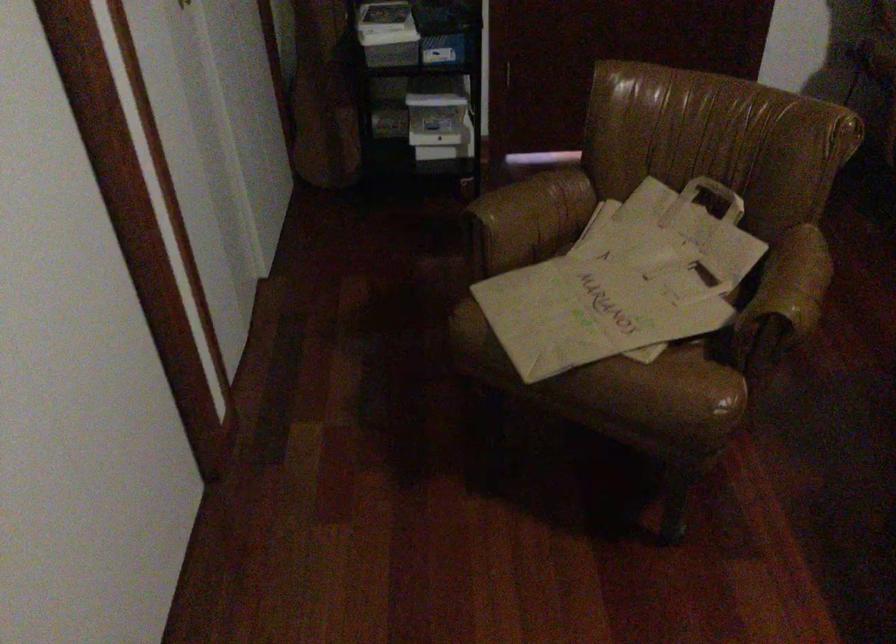
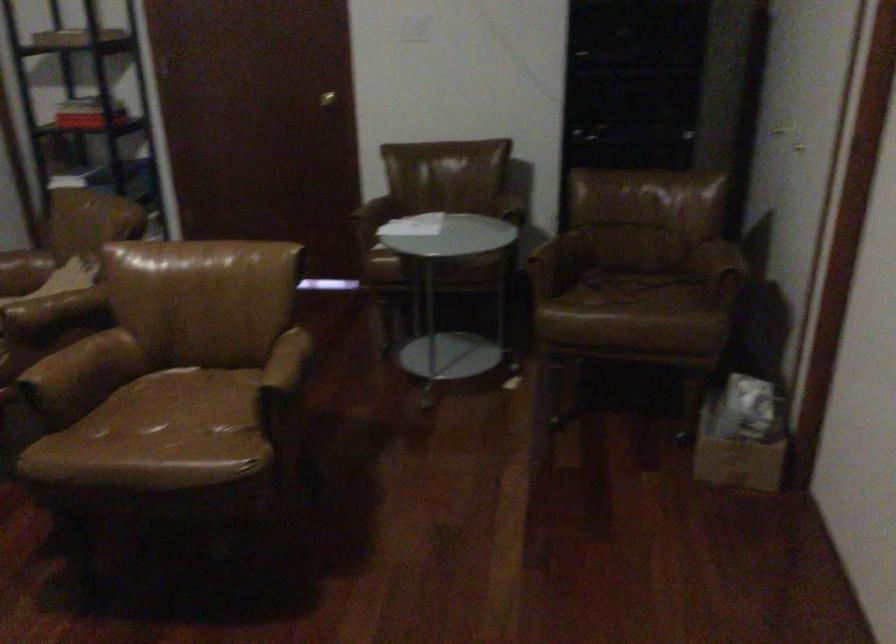
Question: I am providing you with two images of the same scene from different viewpoints. After the viewpoint changes to image2, which objects are now occluded?

Choices:
 (A) patterned ceramic cup
 (B) brass door knob
 (C) paper bag handle
 (D) chair armrest

Answer: (C)